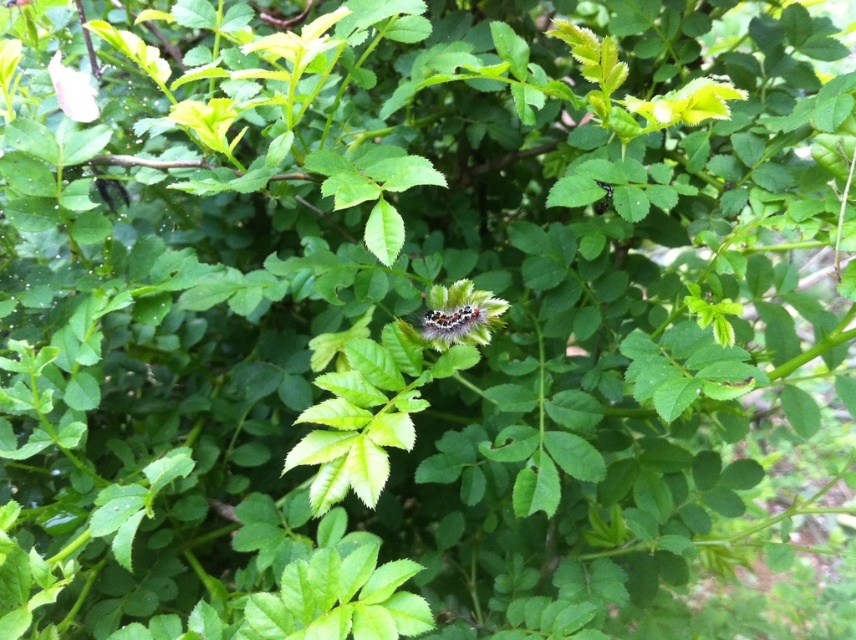
Question: In this image, where is green fuzzy leaf at upper center located relative to smooth pink petal at upper left?

Choices:
 (A) right
 (B) left

Answer: (A)

Question: Does green fuzzy leaf at upper center appear under smooth pink petal at upper left?

Choices:
 (A) no
 (B) yes

Answer: (B)

Question: Which object is the closest to the fluffy multicolored caterpillar at center?

Choices:
 (A) green fuzzy leaf at upper center
 (B) smooth pink petal at upper left

Answer: (A)

Question: Estimate the real-world distances between objects in this image. Which object is farther from the green fuzzy leaf at upper center?

Choices:
 (A) smooth pink petal at upper left
 (B) fluffy multicolored caterpillar at center

Answer: (A)

Question: Which point is closer to the camera?

Choices:
 (A) green fuzzy leaf at upper center
 (B) smooth pink petal at upper left
 (C) fluffy multicolored caterpillar at center

Answer: (A)

Question: Is fluffy multicolored caterpillar at center below green fuzzy leaf at upper center?

Choices:
 (A) yes
 (B) no

Answer: (A)